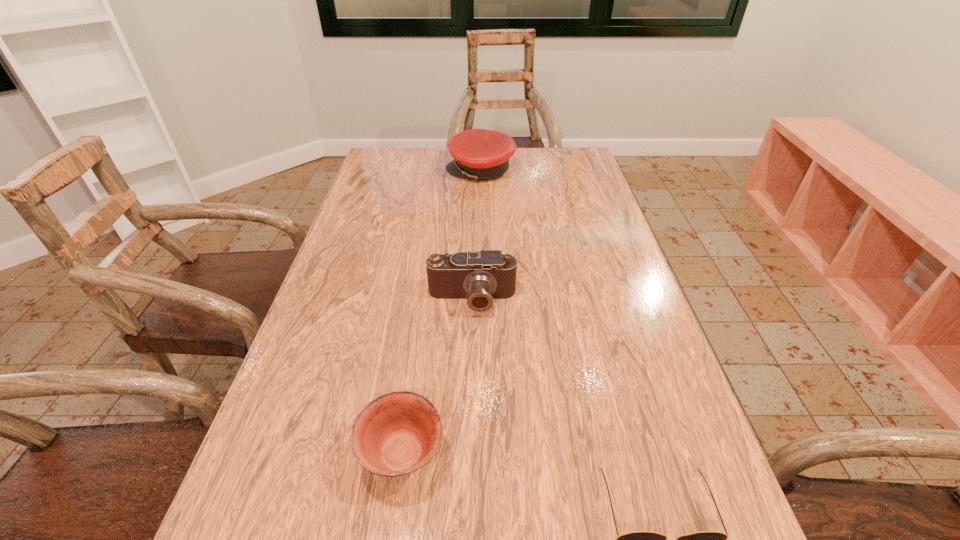
Find the location of a particular element. This screenshot has height=540, width=960. cap is located at coordinates (478, 153).

The height and width of the screenshot is (540, 960). What are the coordinates of `the third nearest object` in the screenshot? It's located at (479, 277).

This screenshot has height=540, width=960. Find the location of `the second shortest object`. the second shortest object is located at coordinates (397, 433).

Find the location of a particular element. The height and width of the screenshot is (540, 960). vacant space located on the front of the farthest object with an emblem is located at coordinates [x=389, y=171].

Locate an element on the screen. Image resolution: width=960 pixels, height=540 pixels. blank space located 0.180m on the front of the farthest object with an emblem is located at coordinates (392, 171).

Find the location of `blank space located on the front of the farthest object with an emblem`. blank space located on the front of the farthest object with an emblem is located at coordinates (413, 171).

Where is `vacant position located 0.090m on the front-facing side of the third nearest object`? The image size is (960, 540). vacant position located 0.090m on the front-facing side of the third nearest object is located at coordinates (470, 351).

Where is `free spot located on the back of the bowl`? The width and height of the screenshot is (960, 540). free spot located on the back of the bowl is located at coordinates (419, 339).

The width and height of the screenshot is (960, 540). In order to click on object at the far edge in this screenshot , I will do coord(478,153).

Where is `free spot at the far edge of the desktop`? free spot at the far edge of the desktop is located at coordinates (538, 163).